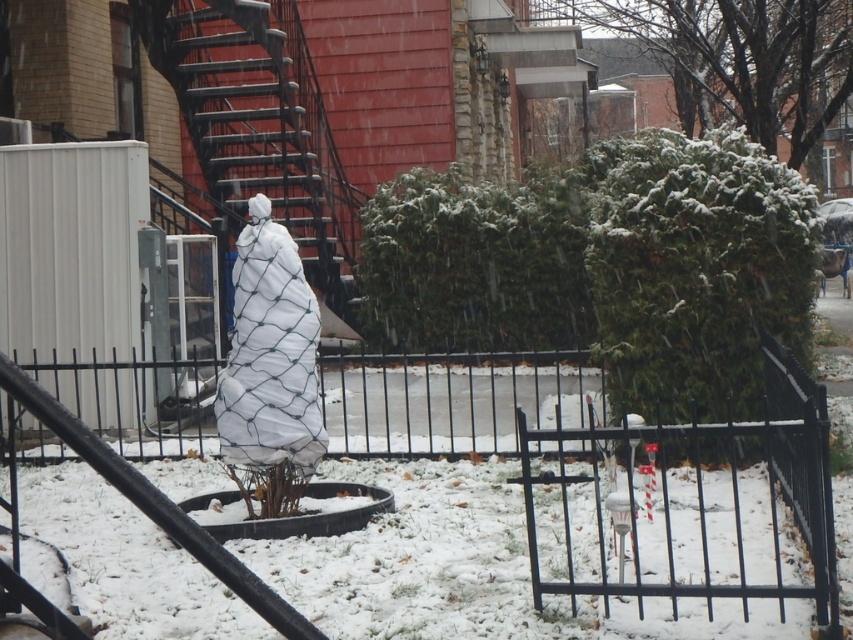
Who is taller, metallic black staircase at center or white mesh bag at center?

Standing taller between the two is metallic black staircase at center.

Which is more to the left, metallic black staircase at center or white mesh bag at center?

metallic black staircase at center

Where is `metallic black staircase at center`? metallic black staircase at center is located at coordinates 260,128.

At what (x,y) coordinates should I click in order to perform the action: click on metallic black staircase at center. Please return your answer as a coordinate pair (x, y). Looking at the image, I should click on (260, 128).

Which is more to the left, black metal fence at center or metallic black staircase at center?

Positioned to the left is metallic black staircase at center.

Which is in front, point (802, 502) or point (195, 44)?

Positioned in front is point (802, 502).

At what (x,y) coordinates should I click in order to perform the action: click on black metal fence at center. Please return your answer as a coordinate pair (x, y). The height and width of the screenshot is (640, 853). Looking at the image, I should click on (714, 502).

Is point (730, 422) more distant than point (292, 380)?

No, it is not.

Does black metal fence at center appear under white mesh bag at center?

Yes.

Is point (724, 595) in front of point (250, 307)?

That is True.

Locate an element on the screen. This screenshot has height=640, width=853. black metal fence at center is located at coordinates tap(714, 502).